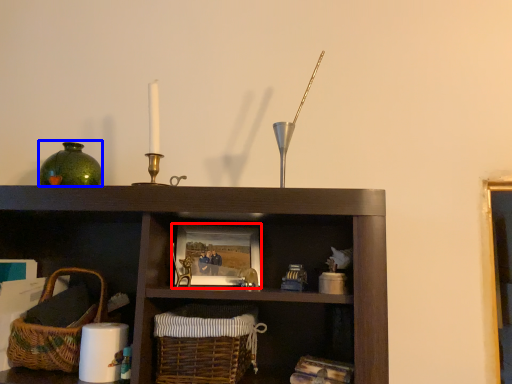
Question: Which of the following is the closest to the observer, picture frame (highlighted by a red box) or glass vase (highlighted by a blue box)?

Choices:
 (A) picture frame
 (B) glass vase

Answer: (A)